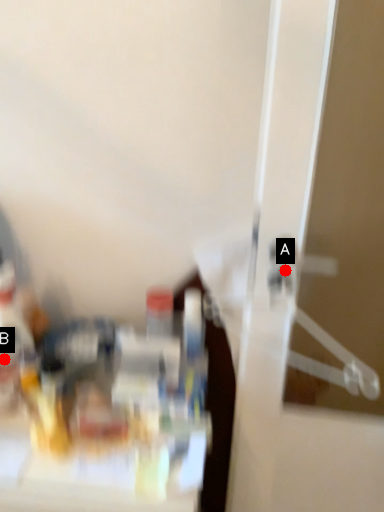
Question: Two points are circled on the image, labeled by A and B beside each circle. Which point is closer to the camera?

Choices:
 (A) A is closer
 (B) B is closer

Answer: (A)